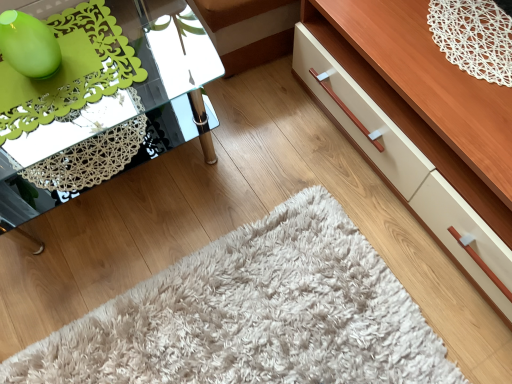
Where is `free point above clear glass table at left (from a real-world perspective)`? This screenshot has width=512, height=384. free point above clear glass table at left (from a real-world perspective) is located at coordinates (73, 62).